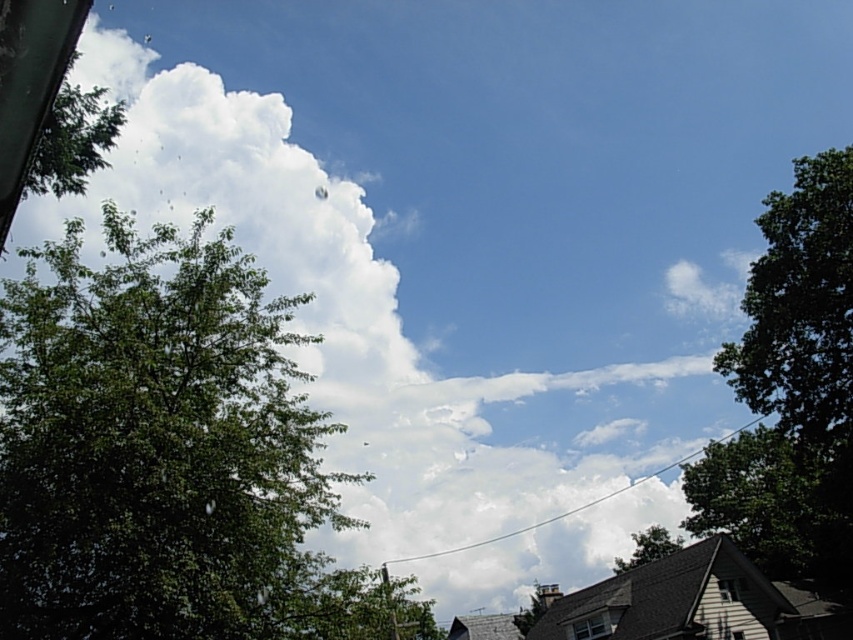
Is green leafy tree at left shorter than green leafy tree at center?

No.

What do you see at coordinates (157, 448) in the screenshot? I see `green leafy tree at left` at bounding box center [157, 448].

Locate an element on the screen. The image size is (853, 640). green leafy tree at left is located at coordinates (157, 448).

I want to click on green leafy tree at left, so click(157, 448).

Measure the distance from green leafy tree at right to green leafy tree at center.

A distance of 16.52 meters exists between green leafy tree at right and green leafy tree at center.

Who is positioned more to the right, green leafy tree at right or green leafy tree at center?

green leafy tree at right is more to the right.

Which is behind, point (733, 355) or point (624, 566)?

The point (624, 566) is more distant.

Where is `green leafy tree at right`? This screenshot has height=640, width=853. green leafy tree at right is located at coordinates (790, 388).

Does point (24, 333) come farther from viewer compared to point (761, 388)?

No, it is in front of (761, 388).

Does green leafy tree at left have a lesser height compared to green leafy tree at right?

Indeed, green leafy tree at left has a lesser height compared to green leafy tree at right.

Is point (9, 305) positioned behind point (851, 403)?

No.

This screenshot has width=853, height=640. Find the location of `green leafy tree at left`. green leafy tree at left is located at coordinates (157, 448).